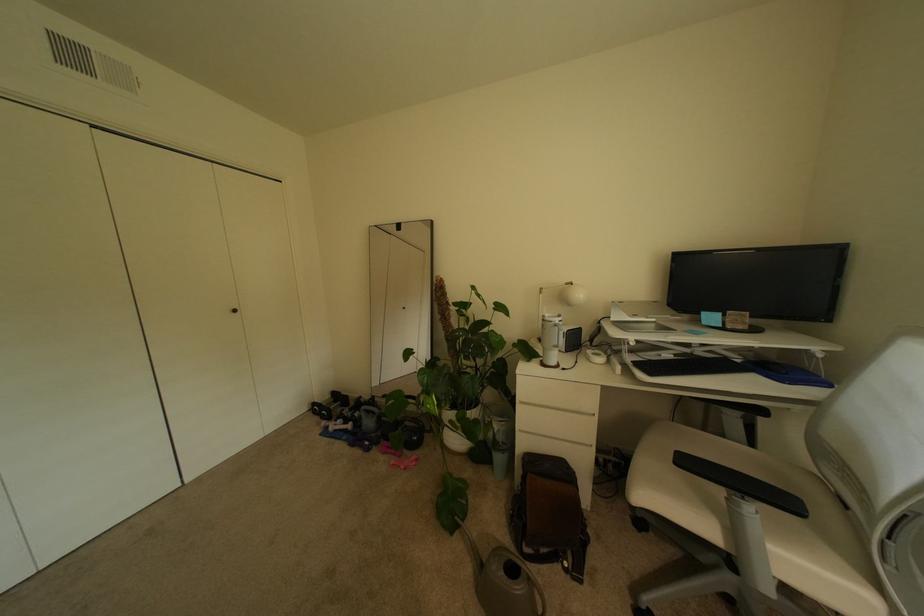
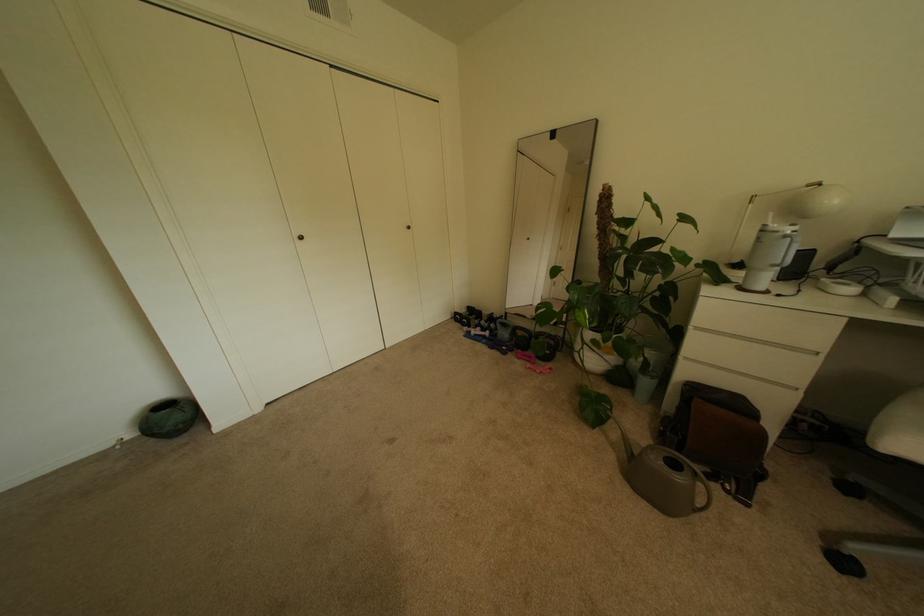
Find the pixel in the second image that matches the point at 391,440 in the first image.

(524, 350)